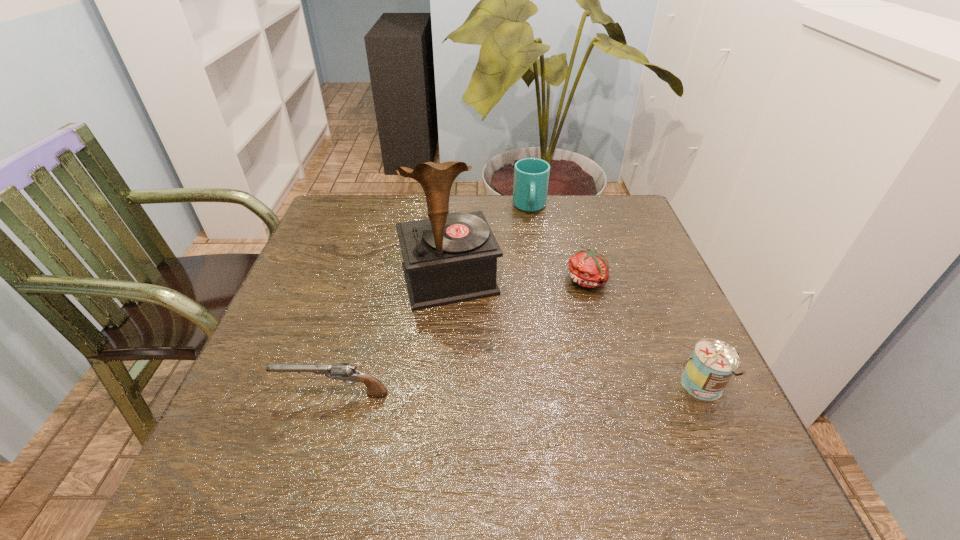
Where is `object positioned at the left edge`? object positioned at the left edge is located at coordinates (341, 371).

This screenshot has width=960, height=540. Identify the location of can that is at the right edge. (709, 369).

Find the location of a particular element. This screenshot has height=540, width=960. tomato located in the right edge section of the desktop is located at coordinates (588, 268).

The image size is (960, 540). I want to click on object present at the near left corner, so click(341, 371).

At what (x,y) coordinates should I click in order to perform the action: click on object situated at the near right corner. Please return your answer as a coordinate pair (x, y). Image resolution: width=960 pixels, height=540 pixels. Looking at the image, I should click on 709,369.

Find the location of `free point at the far edge`. free point at the far edge is located at coordinates (562, 202).

In the image, there is a desktop. Where is `vacant space at the near edge`? This screenshot has height=540, width=960. vacant space at the near edge is located at coordinates (530, 416).

Image resolution: width=960 pixels, height=540 pixels. In the image, there is a desktop. Identify the location of blank space at the left edge. (330, 275).

Image resolution: width=960 pixels, height=540 pixels. Find the location of `vacant space at the right edge of the desktop`. vacant space at the right edge of the desktop is located at coordinates (667, 286).

Locate an element on the screen. free space at the far left corner of the desktop is located at coordinates (327, 226).